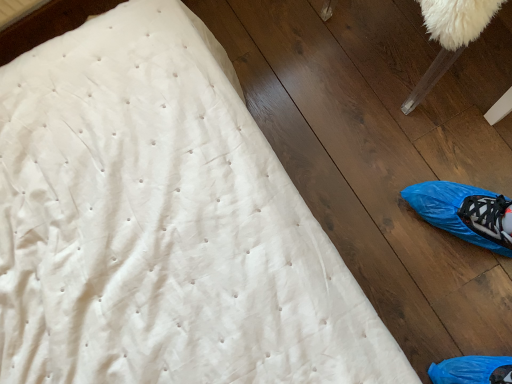
Find the location of a particular element. The height and width of the screenshot is (384, 512). white fluffy bean bag chair at upper right is located at coordinates (449, 37).

What do you see at coordinates (449, 37) in the screenshot? This screenshot has height=384, width=512. I see `white fluffy bean bag chair at upper right` at bounding box center [449, 37].

What are the coordinates of `white fluffy bean bag chair at upper right` in the screenshot? It's located at (449, 37).